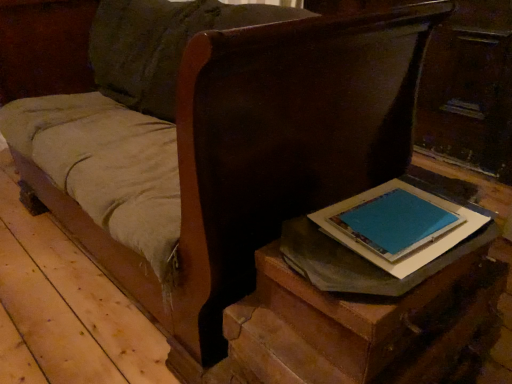
Question: Does blue paper at right lie behind matte brown table at lower right?

Choices:
 (A) no
 (B) yes

Answer: (B)

Question: Can we say blue paper at right lies outside matte brown table at lower right?

Choices:
 (A) no
 (B) yes

Answer: (A)

Question: Is blue paper at right thinner than matte brown table at lower right?

Choices:
 (A) yes
 (B) no

Answer: (A)

Question: Is blue paper at right to the right of matte brown table at lower right from the viewer's perspective?

Choices:
 (A) yes
 (B) no

Answer: (A)

Question: From a real-world perspective, is blue paper at right positioned over matte brown table at lower right based on gravity?

Choices:
 (A) no
 (B) yes

Answer: (B)

Question: Is blue paper at right far away from matte brown table at lower right?

Choices:
 (A) yes
 (B) no

Answer: (B)

Question: Can you confirm if matte brown table at lower right is bigger than blue paper at right?

Choices:
 (A) no
 (B) yes

Answer: (B)

Question: Does matte brown table at lower right turn towards blue paper at right?

Choices:
 (A) no
 (B) yes

Answer: (A)

Question: Is matte brown table at lower right thinner than blue paper at right?

Choices:
 (A) yes
 (B) no

Answer: (B)

Question: Can blue paper at right be found inside matte brown table at lower right?

Choices:
 (A) no
 (B) yes

Answer: (B)

Question: Is matte brown table at lower right outside of blue paper at right?

Choices:
 (A) yes
 (B) no

Answer: (A)

Question: Considering the relative sizes of matte brown table at lower right and blue paper at right in the image provided, is matte brown table at lower right smaller than blue paper at right?

Choices:
 (A) no
 (B) yes

Answer: (A)

Question: Is matte brown table at lower right bigger or smaller than blue paper at right?

Choices:
 (A) small
 (B) big

Answer: (B)